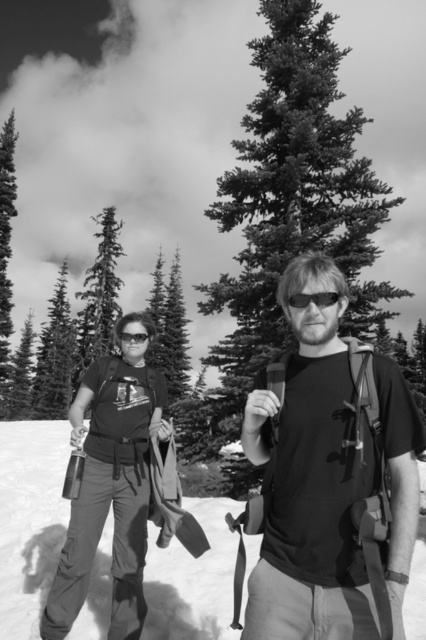
Can you confirm if matte black t-shirt at center is thinner than matte black goggles at center?

Incorrect, matte black t-shirt at center's width is not less than matte black goggles at center's.

Can you confirm if matte black t-shirt at center is positioned to the left of matte black goggles at center?

Incorrect, matte black t-shirt at center is not on the left side of matte black goggles at center.

Find the location of a particular element. matte black t-shirt at center is located at coordinates (331, 477).

Who is positioned more to the left, matte black t-shirt at center or white snow at lower left?

From the viewer's perspective, matte black t-shirt at center appears more on the left side.

Locate an element on the screen. The height and width of the screenshot is (640, 426). matte black t-shirt at center is located at coordinates 331,477.

Find the location of a particular element. Image resolution: width=426 pixels, height=640 pixels. matte black t-shirt at center is located at coordinates (331, 477).

Identify the location of matte black t-shirt at center. (331, 477).

Is brushed metal water bottle at left to the left of matte black goggles at center from the viewer's perspective?

Correct, you'll find brushed metal water bottle at left to the left of matte black goggles at center.

Based on the photo, is brushed metal water bottle at left below matte black goggles at center?

Yes, brushed metal water bottle at left is below matte black goggles at center.

Does point (117, 449) lie behind point (313, 300)?

Yes, it is.

I want to click on brushed metal water bottle at left, so click(111, 484).